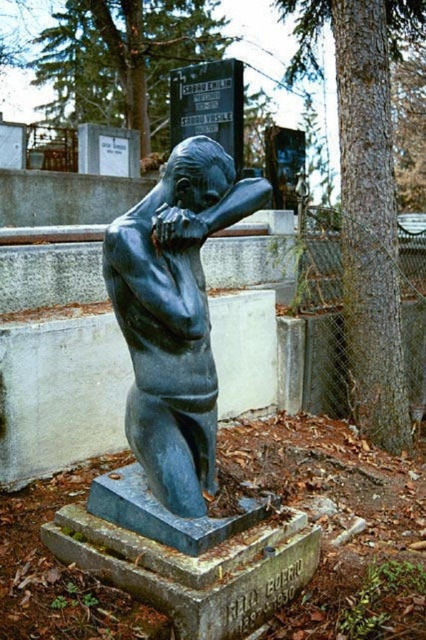
Is point (157, 472) positioned after point (115, 116)?

No.

Can you confirm if bronze statue at center is smaller than green textured tree at upper center?

Yes, bronze statue at center is smaller than green textured tree at upper center.

Consider the image. Measure the distance between bronze statue at center and camera.

bronze statue at center and camera are 2.70 meters apart from each other.

Locate an element on the screen. This screenshot has height=640, width=426. bronze statue at center is located at coordinates (175, 316).

Who is taller, smooth brown bark at center or green textured tree at upper center?

Standing taller between the two is smooth brown bark at center.

Which is in front, point (362, 269) or point (89, 118)?

Point (362, 269)

Between point (388, 56) and point (192, 38), which one is positioned in front?

Point (388, 56) is more forward.

Locate an element on the screen. This screenshot has height=640, width=426. smooth brown bark at center is located at coordinates (365, 196).

Who is shorter, bronze statue at center or smooth brown bark at center?

bronze statue at center

Measure the distance between bronze statue at center and smooth brown bark at center.

The distance of bronze statue at center from smooth brown bark at center is 8.83 feet.

Looking at this image, measure the distance between point (222,177) and camera.

The distance of point (222,177) from camera is 2.87 meters.

I want to click on bronze statue at center, so click(175, 316).